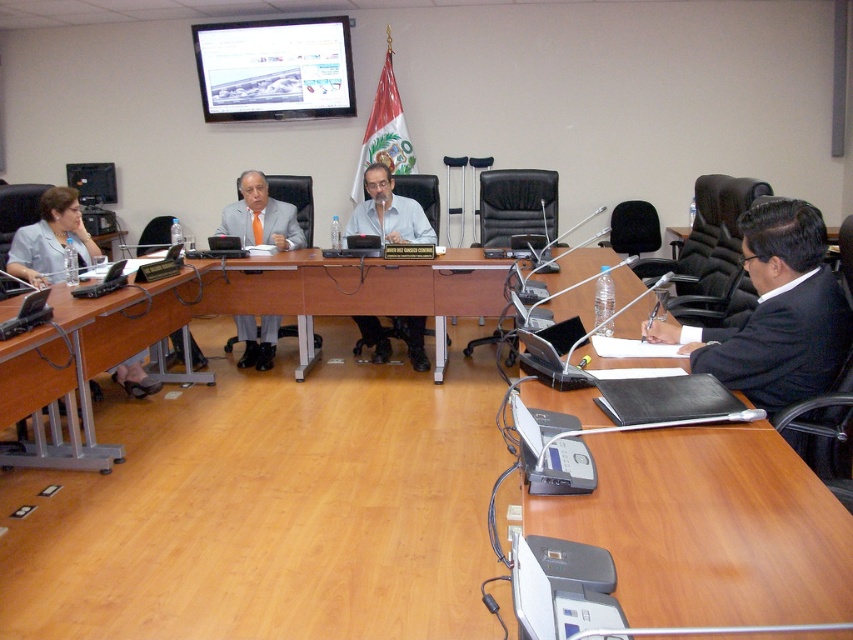
Question: Which point appears closest to the camera in this image?

Choices:
 (A) (109, 173)
 (B) (68, 189)
 (C) (305, 241)
 (D) (386, 180)

Answer: (B)

Question: Which object appears farthest from the camera in this image?

Choices:
 (A) matte black laptop at left
 (B) brown wooden table at lower left

Answer: (A)

Question: Does matte black laptop at center have a lesser width compared to matte gray suit at center?

Choices:
 (A) no
 (B) yes

Answer: (A)

Question: Is brown wooden table at lower left below matte gray suit at center?

Choices:
 (A) yes
 (B) no

Answer: (A)

Question: Does brown wooden table at lower left appear over matte gray suit at left?

Choices:
 (A) no
 (B) yes

Answer: (A)

Question: Based on their relative distances, which object is nearer to the matte gray suit at left?

Choices:
 (A) matte black laptop at center
 (B) matte black laptop at left

Answer: (A)